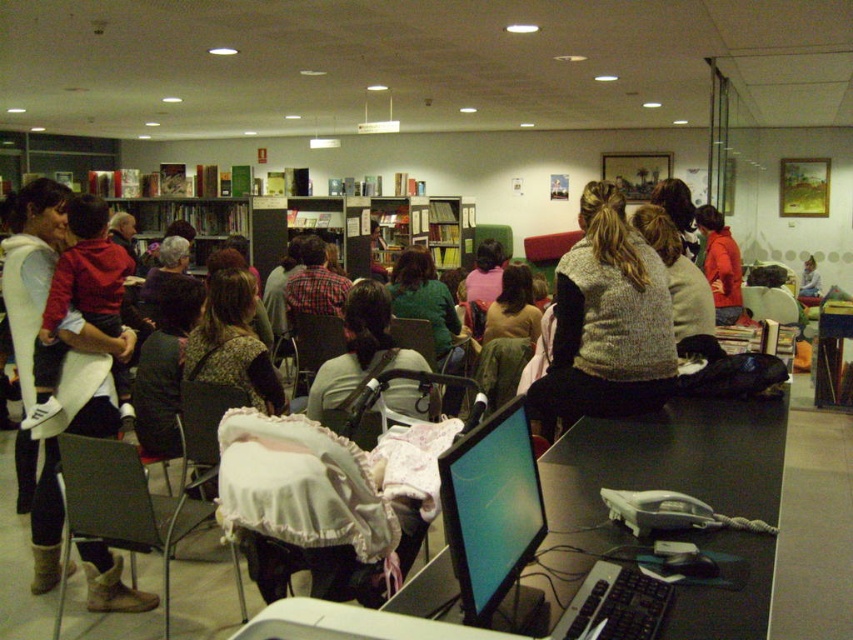
You are a librarian who just noticed a knitted gray sweater at center left on the floor. You want to pick it up and place it on the nearby desk. Which direction should you move the sweater to reach the desk?

The knitted gray sweater at center left is located at point (606,323). The desk is in the foreground, so you should move the sweater towards the lower part of the image to reach the desk.